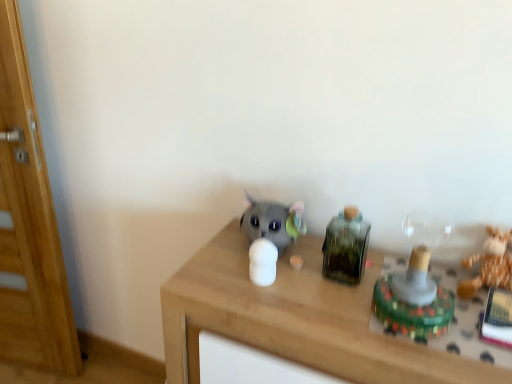
Where is `free area in between translucent plastic toy at right, the second toy positioned from the right, and green glass bottle at center-right, arranged as the third toy when viewed from the right`? free area in between translucent plastic toy at right, the second toy positioned from the right, and green glass bottle at center-right, arranged as the third toy when viewed from the right is located at coordinates (350, 292).